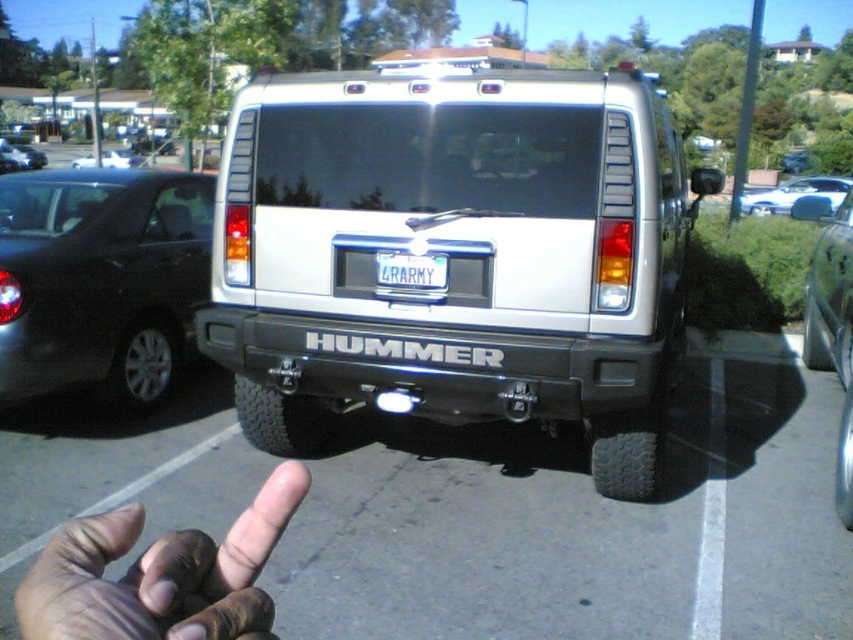
Question: Which point appears closest to the camera in this image?

Choices:
 (A) (90, 164)
 (B) (19, 148)

Answer: (A)

Question: Among these objects, which one is nearest to the camera?

Choices:
 (A) silver metallic hummer at center
 (B) dark skin finger at lower left
 (C) blue metallic license plate at center

Answer: (B)

Question: Considering the relative positions of silver metallic car at right and blue metallic license plate at center in the image provided, where is silver metallic car at right located with respect to blue metallic license plate at center?

Choices:
 (A) left
 (B) right

Answer: (B)

Question: Is dark skin finger at lower left wider than shiny silver car at center?

Choices:
 (A) yes
 (B) no

Answer: (B)

Question: Which object appears farthest from the camera in this image?

Choices:
 (A) white glossy sedan at upper right
 (B) silver metallic hummer at center

Answer: (A)

Question: Is blue metallic license plate at center above white matte sedan at upper left?

Choices:
 (A) yes
 (B) no

Answer: (B)